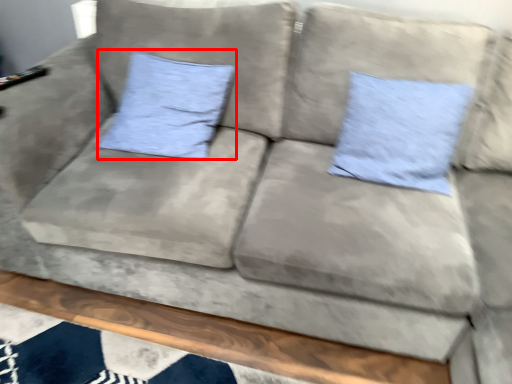
Question: Observing the image, what is the correct spatial positioning of pillow (annotated by the red box) in reference to pillow?

Choices:
 (A) right
 (B) left

Answer: (B)